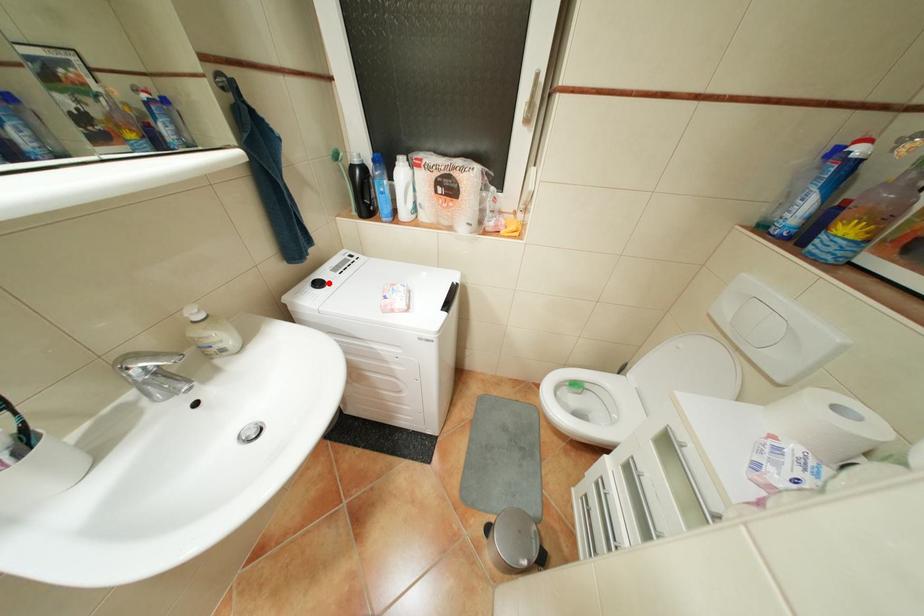
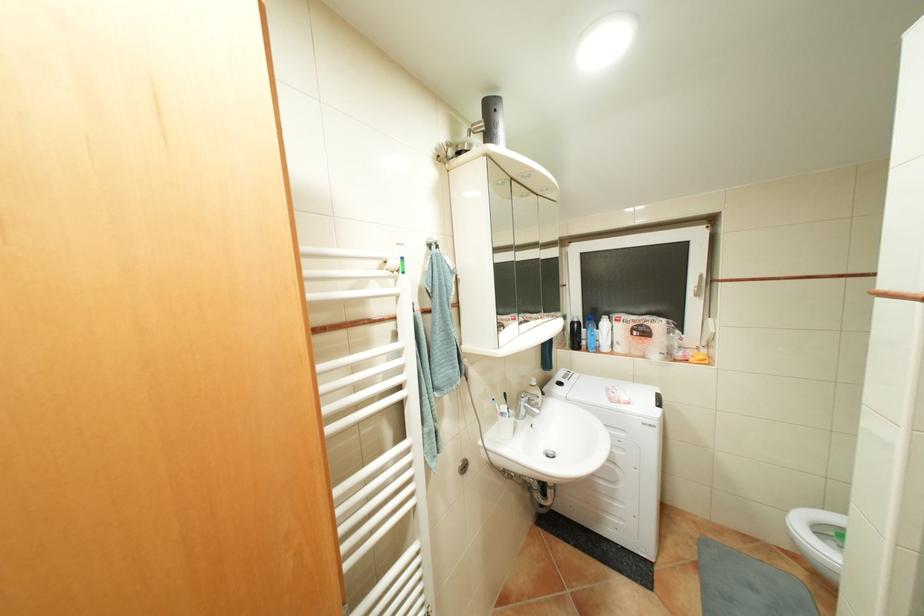
In the second image, find the point that corresponds to the highlighted location in the first image.

(569, 383)